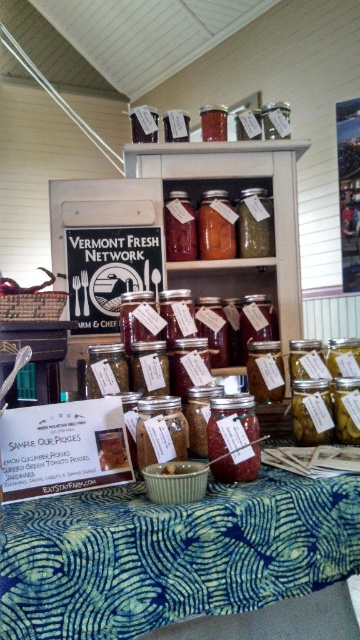
Is point (62, 560) more distant than point (259, 461)?

That is False.

Between point (181, 513) and point (249, 436), which one is positioned behind?

Positioned behind is point (249, 436).

Is point (206, 499) positioned behind point (231, 449)?

No.

Image resolution: width=360 pixels, height=640 pixels. In order to click on blue printed fabric at lower center in this screenshot , I will do `click(171, 554)`.